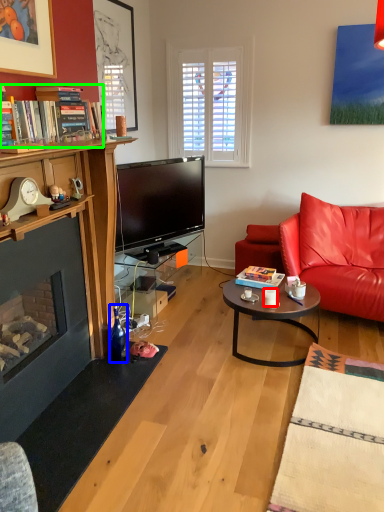
Question: Estimate the real-world distances between objects in this image. Which object is farther from coffee cup (highlighted by a red box), bottle (highlighted by a blue box) or book (highlighted by a green box)?

Choices:
 (A) bottle
 (B) book

Answer: (B)